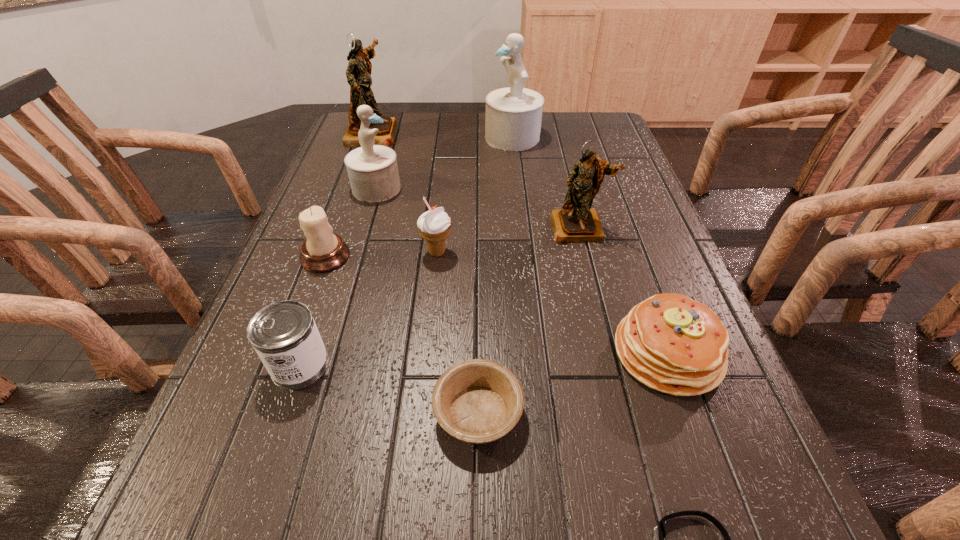
This screenshot has width=960, height=540. I want to click on the seventh tallest object, so [x=284, y=334].

Find the location of `the third shortest object`. the third shortest object is located at coordinates (669, 342).

Find the location of `the second shortest object`. the second shortest object is located at coordinates (477, 401).

Find the location of a particular element. bowl is located at coordinates click(477, 401).

This screenshot has height=540, width=960. I want to click on vacant area situated at the beak of the bigger white figurine, so click(453, 138).

This screenshot has height=540, width=960. I want to click on vacant area located at the beak of the bigger white figurine, so click(420, 138).

Locate an element on the screen. Image resolution: width=960 pixels, height=540 pixels. vacant space situated at the beak of the bigger white figurine is located at coordinates (398, 138).

Find the location of a particular element. Image resolution: width=960 pixels, height=540 pixels. vacant region located on the front-facing side of the farther gold figurine is located at coordinates (433, 133).

Locate an element on the screen. This screenshot has height=540, width=960. free space located at the beak of the smaller white figurine is located at coordinates (445, 188).

Where is `vacant space located 0.360m on the front-facing side of the nearer gold figurine`? vacant space located 0.360m on the front-facing side of the nearer gold figurine is located at coordinates (618, 382).